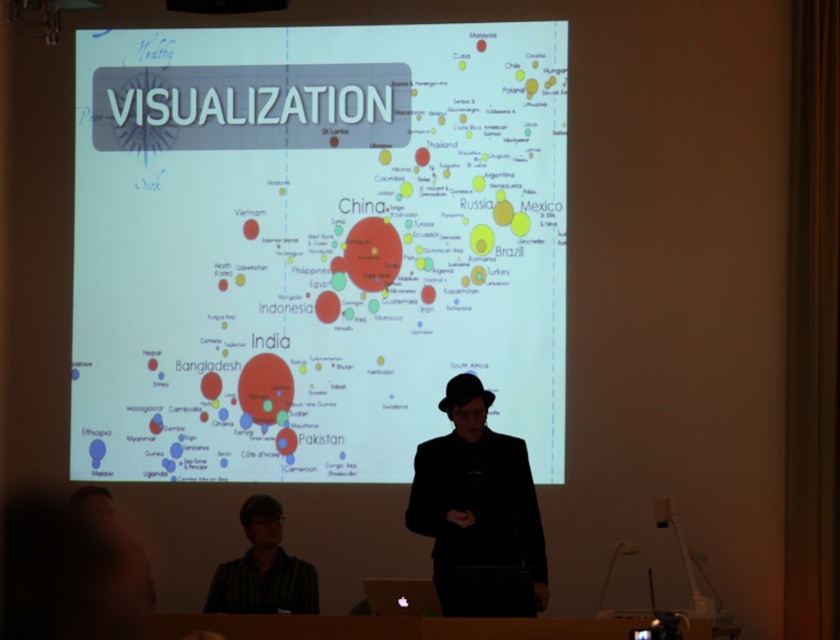
Question: Is silver metallic laptop at center below black plastic projector at upper center?

Choices:
 (A) no
 (B) yes

Answer: (B)

Question: Is silver metallic laptop at center to the left of black plastic projector at upper center from the viewer's perspective?

Choices:
 (A) no
 (B) yes

Answer: (A)

Question: Which object appears farthest from the camera in this image?

Choices:
 (A) silver metallic laptop at center
 (B) matte white map at center

Answer: (B)

Question: Which of the following is the farthest from the observer?

Choices:
 (A) striped shirt at lower left
 (B) black plastic projector at upper center
 (C) silver metallic laptop at center

Answer: (B)

Question: Which object is positioned farthest from the striped shirt at lower left?

Choices:
 (A) black matte suit at center
 (B) silver metallic laptop at center
 (C) matte white map at center
 (D) black plastic projector at upper center

Answer: (D)

Question: Can you confirm if black matte suit at center is positioned below striped shirt at lower left?

Choices:
 (A) no
 (B) yes

Answer: (A)